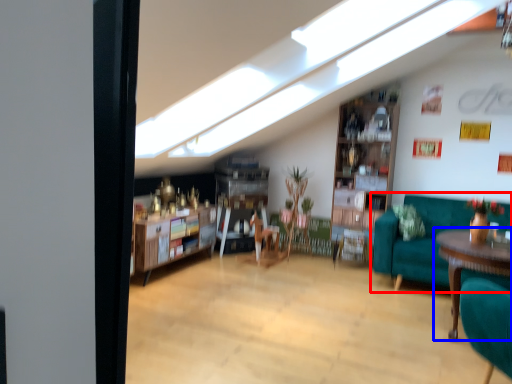
Question: Among these objects, which one is farthest to the camera, studio couch (highlighted by a red box) or table (highlighted by a blue box)?

Choices:
 (A) studio couch
 (B) table

Answer: (A)